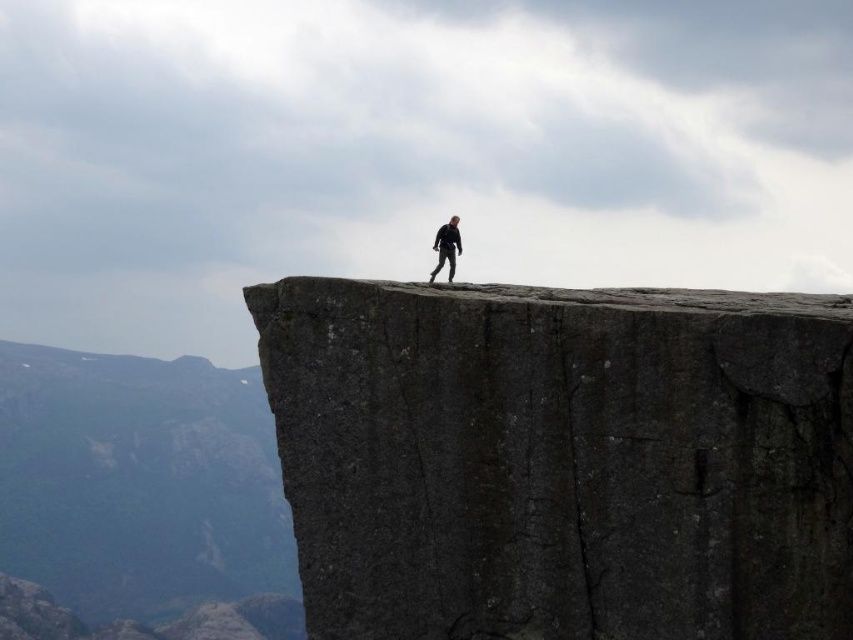
Question: Considering the relative positions of dark gray stone at center and black matte suit at center in the image provided, where is dark gray stone at center located with respect to black matte suit at center?

Choices:
 (A) left
 (B) right

Answer: (B)

Question: Estimate the real-world distances between objects in this image. Which object is closer to the black matte suit at center?

Choices:
 (A) dark gray rock at center
 (B) dark gray stone at center

Answer: (B)

Question: Which point is closer to the camera?

Choices:
 (A) (450, 273)
 (B) (154, 358)

Answer: (A)

Question: Can you confirm if dark gray stone at center is bigger than dark gray rock at center?

Choices:
 (A) no
 (B) yes

Answer: (A)

Question: In this image, where is dark gray rock at center located relative to black matte suit at center?

Choices:
 (A) above
 (B) below

Answer: (B)

Question: Among these objects, which one is farthest from the camera?

Choices:
 (A) black matte suit at center
 (B) dark gray rock at center
 (C) dark gray stone at center

Answer: (B)